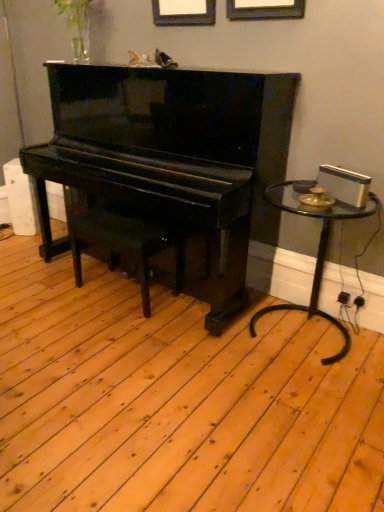
Question: In terms of width, does black polished wood music stool at center look wider or thinner when compared to glossy black piano at center?

Choices:
 (A) thin
 (B) wide

Answer: (A)

Question: Is black polished wood music stool at center to the left or to the right of glossy black piano at center in the image?

Choices:
 (A) left
 (B) right

Answer: (A)

Question: Estimate the real-world distances between objects in this image. Which object is closer to the black polished wood music stool at center?

Choices:
 (A) glossy black piano at center
 (B) transparent glass table at right

Answer: (A)

Question: Estimate the real-world distances between objects in this image. Which object is closer to the transparent glass table at right?

Choices:
 (A) glossy black piano at center
 (B) black polished wood music stool at center

Answer: (A)